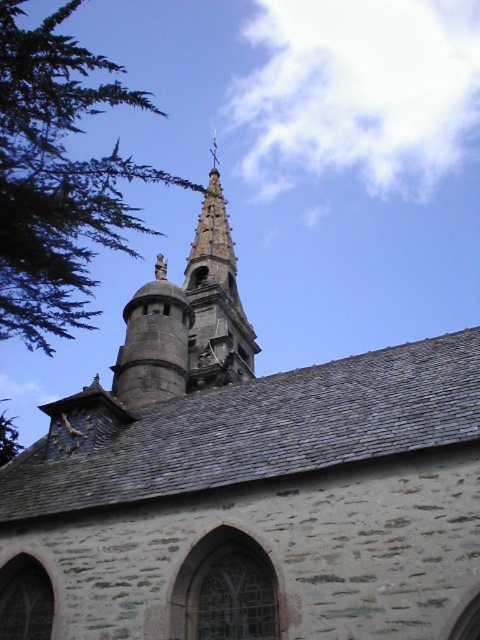
Who is taller, green leafy tree at upper left or smooth stone bell tower at upper center?

green leafy tree at upper left

What do you see at coordinates (58, 177) in the screenshot? I see `green leafy tree at upper left` at bounding box center [58, 177].

Does point (2, 168) come in front of point (216, 308)?

Yes, point (2, 168) is closer to viewer.

Where is `green leafy tree at upper left`? green leafy tree at upper left is located at coordinates (58, 177).